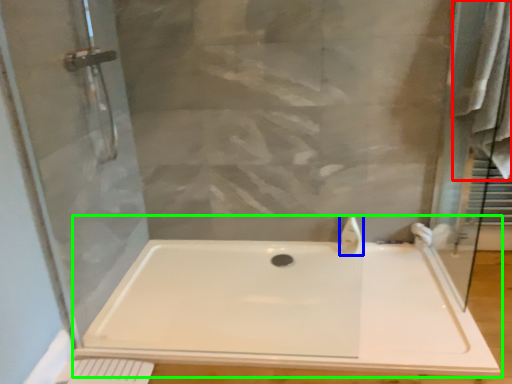
Question: Which is farther away from bath towel (highlighted by a red box)? faucet (highlighted by a blue box) or bathtub (highlighted by a green box)?

Choices:
 (A) faucet
 (B) bathtub

Answer: (B)